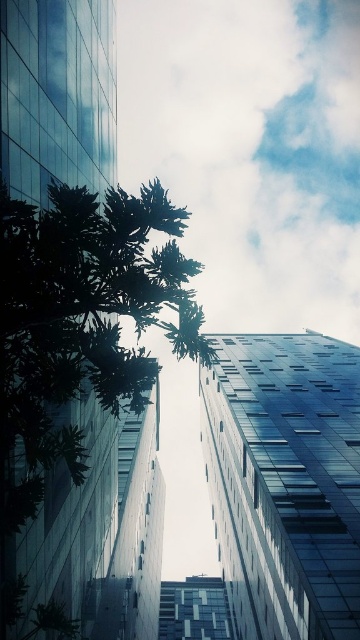
You are standing in the city square and notice a white fluffy cloud at upper center and a green leafy tree at center. From your perspective, which object is positioned to the right side?

The white fluffy cloud at upper center is positioned to the right of the green leafy tree at center.

You are standing at the base of the skyscrapers and looking up. You see two points marked in the image. Which point is closer to you, point (345, 150) or point (169, 234)?

Point (169, 234) is closer to you because it is in front of point (345, 150).

You are an architect designing a new building. You notice the white fluffy cloud at upper center and the green leafy tree at center in the scene. Which object would cast a larger shadow if the sun is directly above them?

The white fluffy cloud at upper center is bigger than the green leafy tree at center, so it would cast a larger shadow.